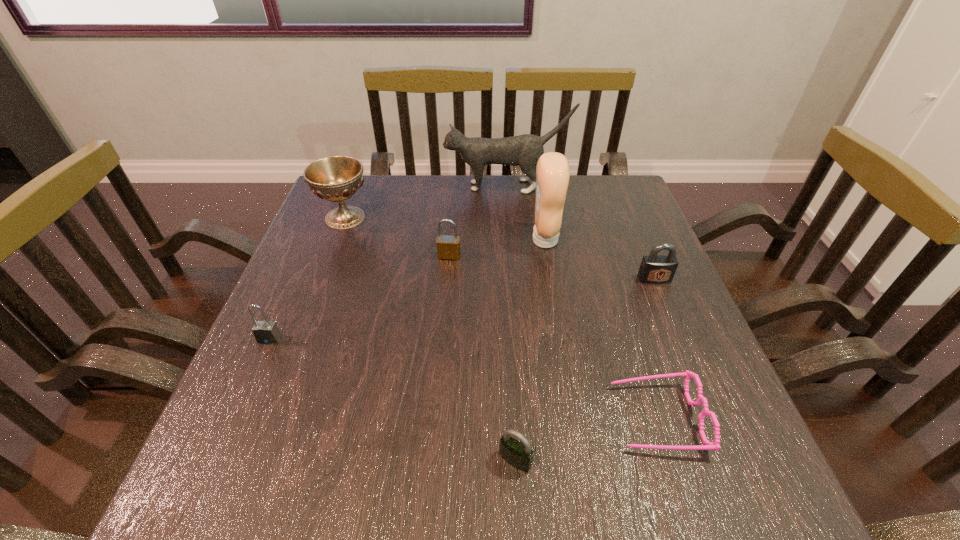
At what (x,y) coordinates should I click in order to perform the action: click on free space at the far right corner of the desktop. Please return your answer as a coordinate pair (x, y). The height and width of the screenshot is (540, 960). Looking at the image, I should click on (584, 184).

The width and height of the screenshot is (960, 540). In order to click on empty location between the second shortest object and the third farthest padlock in this screenshot , I will do `click(393, 400)`.

What are the coordinates of `free spot between the nearest padlock and the condiment` in the screenshot? It's located at (530, 350).

I want to click on vacant area that lies between the farthest object and the nearest padlock, so click(x=511, y=323).

Where is `empty space that is in between the farthest object and the second nearest padlock`? This screenshot has height=540, width=960. empty space that is in between the farthest object and the second nearest padlock is located at coordinates (388, 262).

Locate an element on the screen. This screenshot has width=960, height=540. empty location between the third nearest object and the shortest padlock is located at coordinates (393, 400).

I want to click on free space between the shortest padlock and the farthest padlock, so click(482, 358).

What are the coordinates of `free space between the condiment and the cat` in the screenshot? It's located at (525, 213).

Locate an element on the screen. The image size is (960, 540). vacant area that lies between the shortest object and the sixth shortest object is located at coordinates [x=501, y=318].

Find the location of a particular element. The width and height of the screenshot is (960, 540). free space that is in between the nearest padlock and the condiment is located at coordinates 530,350.